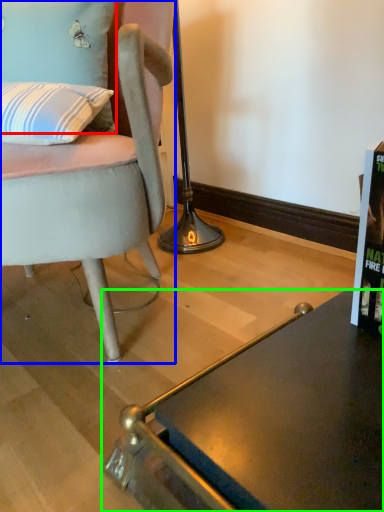
Question: Based on their relative distances, which object is nearer to pillow (highlighted by a red box)? Choose from chair (highlighted by a blue box) and desk (highlighted by a green box).

Choices:
 (A) chair
 (B) desk

Answer: (A)